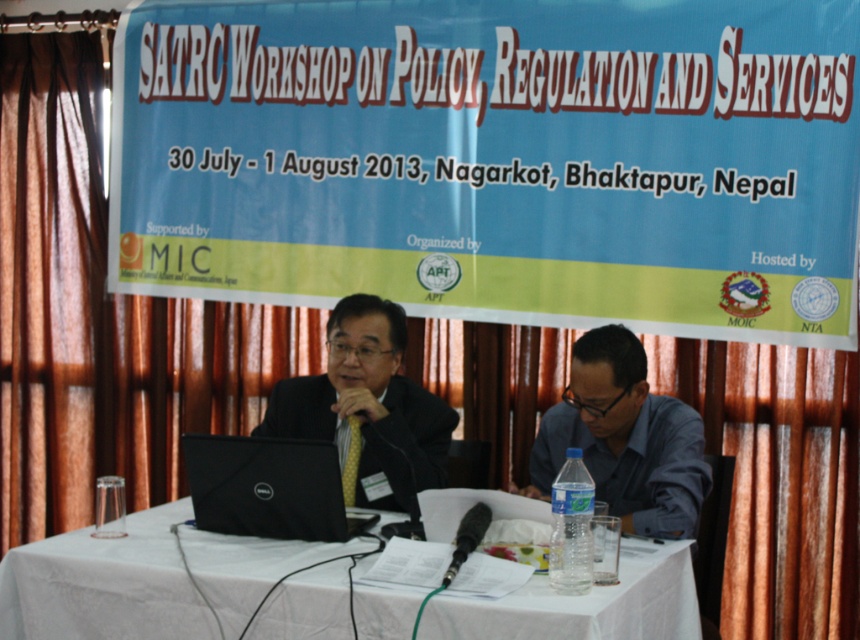
Consider the image. You are a photographer positioned at the back of the workshop. You want to take a photo of the black matte laptop at center without the black matte suit at center blocking it. Is it possible to do so?

The black matte laptop at center is behind the black matte suit at center, so it is possible to position yourself in a way that the black matte suit at center does not block the view of the black matte laptop at center by angling the camera appropriately.